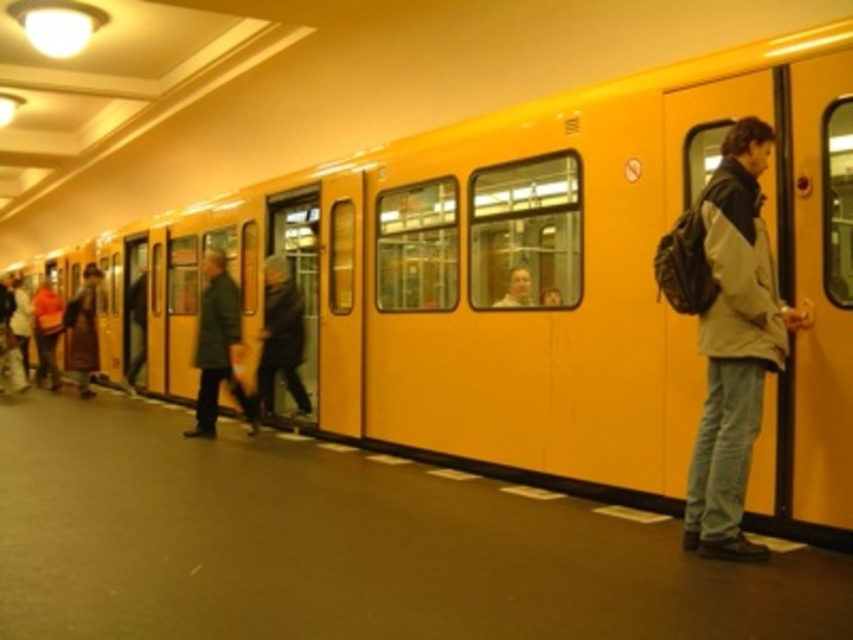
You are a passenger waiting at the subway platform. You notice two jackets hanging from the back of seats inside the train. The jackets are the matte gray jacket at right and the dark brown leather jacket at center. Which jacket is taller?

The matte gray jacket at right is taller than the dark brown leather jacket at center.

You are a passenger on the subway platform looking at two coats. The green wool coat at center and the dark brown leather jacket at center. Which coat is positioned to the left of the other?

The green wool coat at center is to the left of the dark brown leather jacket at center.

You are a passenger waiting at the subway platform. You notice two coats hanging from the train door handle. Which coat is closer to the floor, the green wool coat at center or the dark brown leather jacket at center?

The green wool coat at center is closer to the floor because it is positioned under the dark brown leather jacket at center.